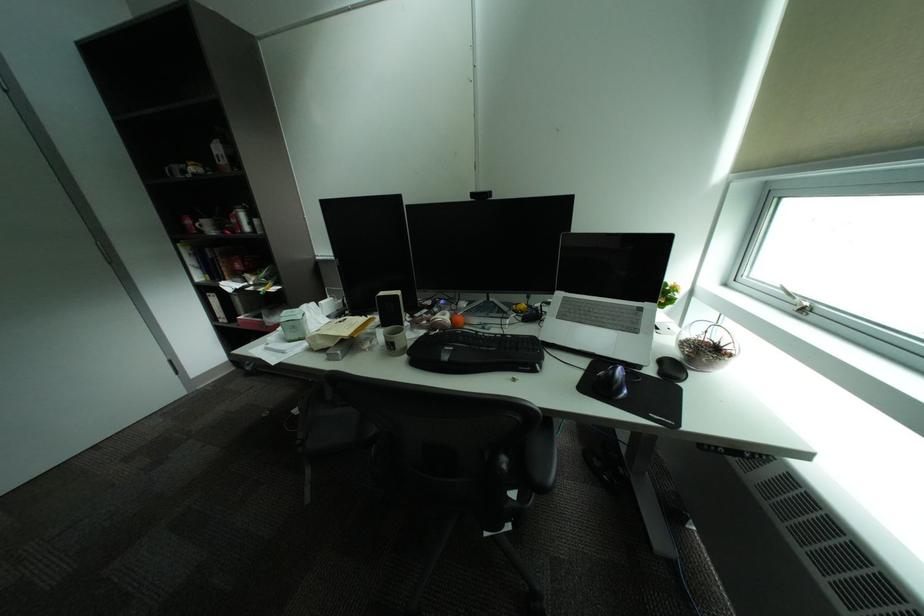
Where would you resting arm the chair armrest? Please return your answer as a coordinate pair (x, y).

(541, 456)